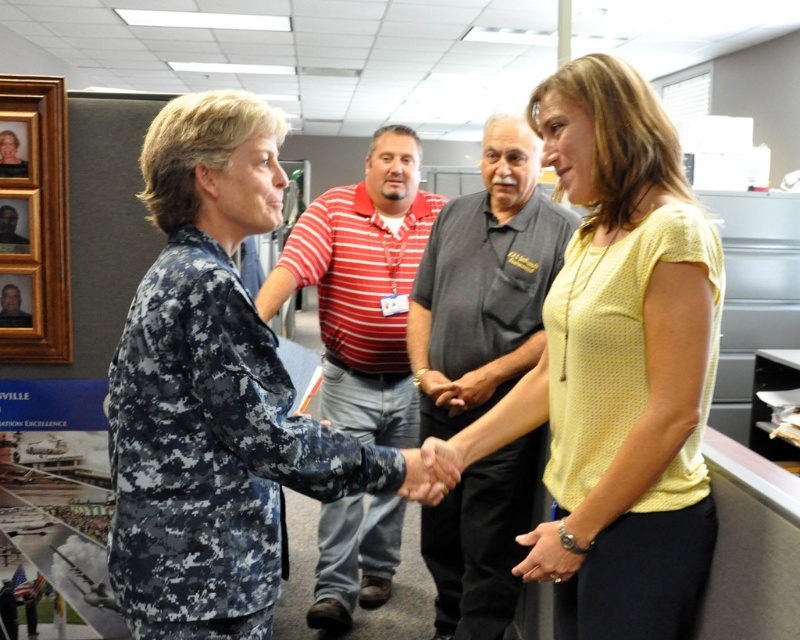
Question: Which point is farther from the camera taking this photo?

Choices:
 (A) (582, 376)
 (B) (12, 76)
 (C) (554, 228)

Answer: (C)

Question: Can you confirm if yellow dotted blouse at center is positioned to the right of striped cotton shirt at center?

Choices:
 (A) yes
 (B) no

Answer: (A)

Question: Is striped cotton shirt at center to the right of brushed metal picture frame at upper left from the viewer's perspective?

Choices:
 (A) yes
 (B) no

Answer: (A)

Question: Does yellow dotted blouse at center have a greater width compared to dark gray shirt at center?

Choices:
 (A) no
 (B) yes

Answer: (B)

Question: Which object is positioned closest to the yellow dotted blouse at center?

Choices:
 (A) brushed metal picture frame at upper left
 (B) striped cotton shirt at center
 (C) wooden picture frame at upper left

Answer: (B)

Question: Estimate the real-world distances between objects in this image. Which object is closer to the dark gray shirt at center?

Choices:
 (A) striped cotton shirt at center
 (B) yellow dotted blouse at center
 (C) wooden picture frame at upper left
 (D) brushed metal picture frame at upper left

Answer: (A)